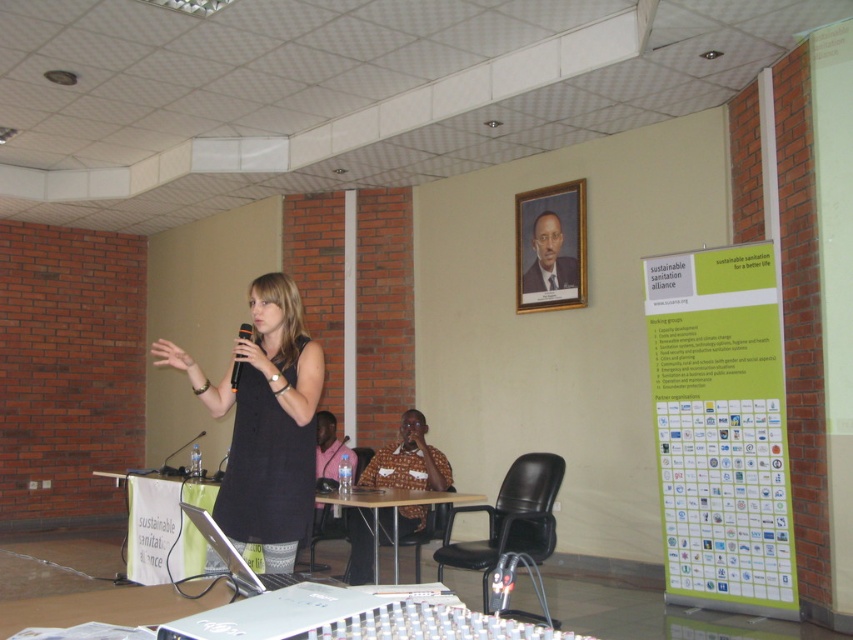
Question: Can you confirm if gold-framed portrait at upper center is positioned below black plastic chair at lower center?

Choices:
 (A) no
 (B) yes

Answer: (A)

Question: Among these objects, which one is nearest to the camera?

Choices:
 (A) green paper poster at right
 (B) black leather chair at center
 (C) gold-framed portrait at upper center

Answer: (B)

Question: Among these objects, which one is farthest from the camera?

Choices:
 (A) black matte dress at center
 (B) pink fabric shirt at center
 (C) black leather chair at center
 (D) gold-framed portrait at upper center

Answer: (D)

Question: Is black matte dress at center wider than black leather chair at center?

Choices:
 (A) no
 (B) yes

Answer: (B)

Question: Does black leather chair at center appear over pink fabric shirt at center?

Choices:
 (A) yes
 (B) no

Answer: (B)

Question: Which point is farther from the camera taking this photo?

Choices:
 (A) (315, 440)
 (B) (669, 330)
 (C) (496, 561)
 (D) (325, 464)

Answer: (D)